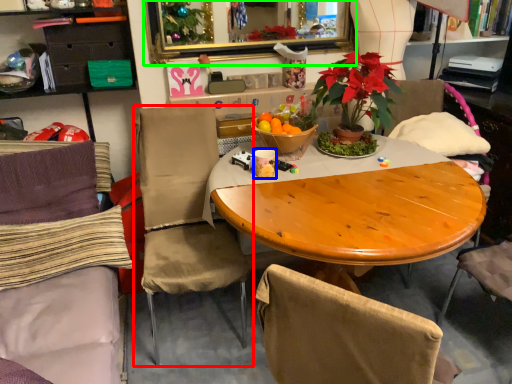
Question: Considering the real-world distances, which object is closest to chair (highlighted by a red box)? coffee cup (highlighted by a blue box) or mirror (highlighted by a green box).

Choices:
 (A) coffee cup
 (B) mirror

Answer: (A)